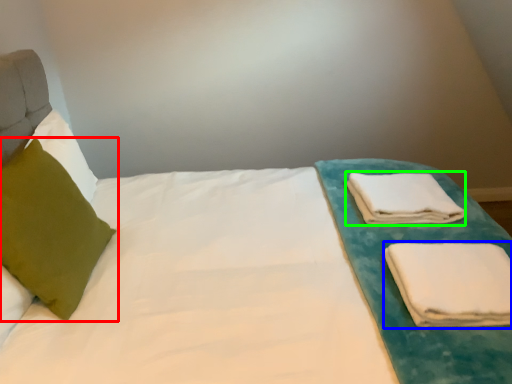
Question: Considering the real-world distances, which object is closest to pillow (highlighted by a red box)? cloth (highlighted by a blue box) or cloth (highlighted by a green box).

Choices:
 (A) cloth
 (B) cloth

Answer: (A)